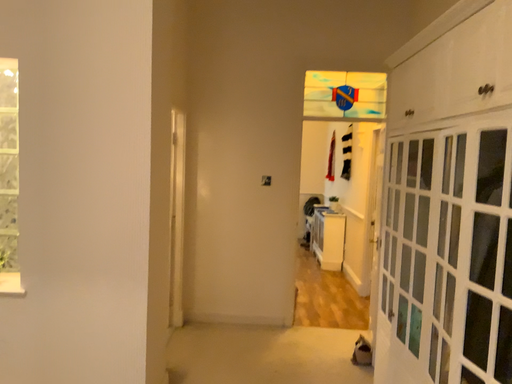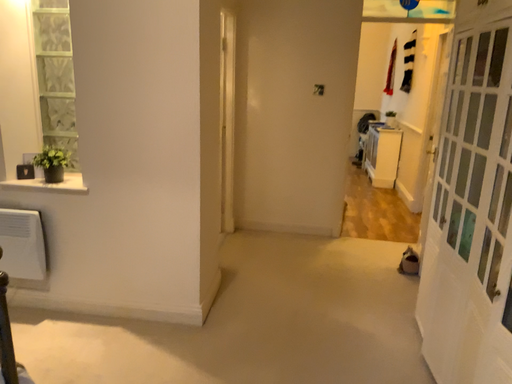
Question: Which way did the camera rotate in the video?

Choices:
 (A) rotated left
 (B) rotated right

Answer: (A)